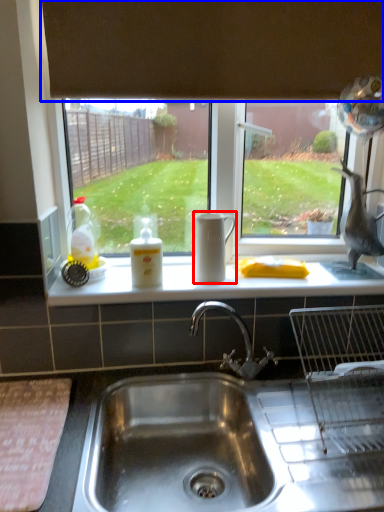
Question: Which object is further to the camera taking this photo, jug (highlighted by a red box) or exhaust hood (highlighted by a blue box)?

Choices:
 (A) jug
 (B) exhaust hood

Answer: (A)